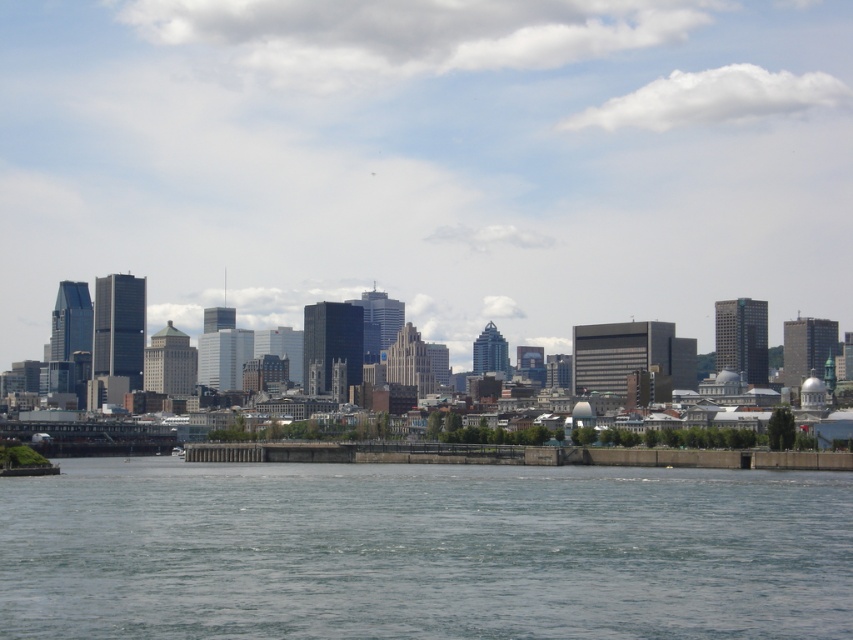
Question: Which of the following is the closest to the observer?

Choices:
 (A) matte glass buildings at center
 (B) clear water at lower center

Answer: (B)

Question: Which point appears closest to the camera in this image?

Choices:
 (A) (809, 483)
 (B) (73, 179)

Answer: (A)

Question: Which point appears farthest from the camera in this image?

Choices:
 (A) (498, 561)
 (B) (302, 145)

Answer: (B)

Question: Is matte glass buildings at center bigger than clear water at lower center?

Choices:
 (A) no
 (B) yes

Answer: (B)

Question: Does matte glass buildings at center appear under clear water at lower center?

Choices:
 (A) yes
 (B) no

Answer: (B)

Question: Can you confirm if matte glass buildings at center is smaller than clear water at lower center?

Choices:
 (A) yes
 (B) no

Answer: (B)